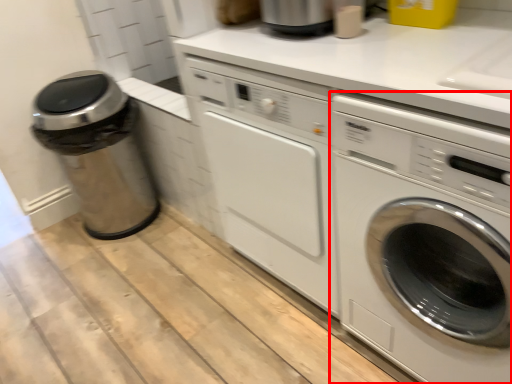
Question: From the image's perspective, what is the correct spatial positioning of washing machine (annotated by the red box) in reference to garbage?

Choices:
 (A) above
 (B) below

Answer: (B)